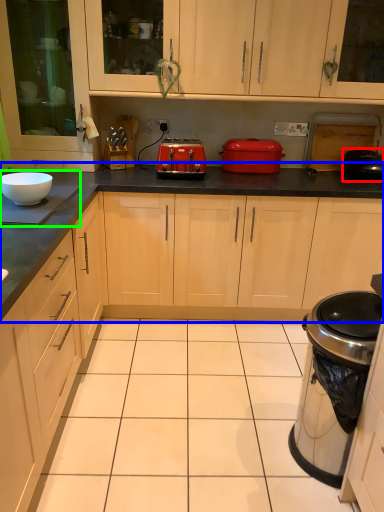
Question: Which object is the farthest from appliance (highlighted by a red box)? Choose among these: countertop (highlighted by a blue box) or appliance (highlighted by a green box).

Choices:
 (A) countertop
 (B) appliance

Answer: (B)